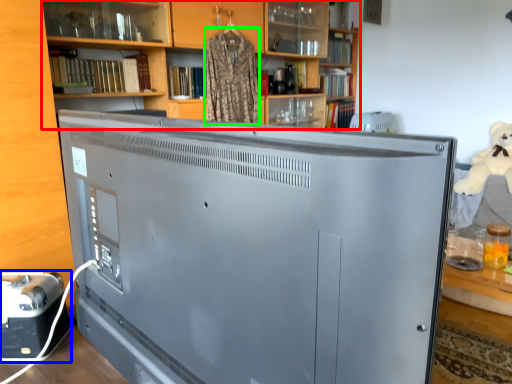
Question: Which is nearer to the bookcase (highlighted by a red box)? appliance (highlighted by a blue box) or clothing (highlighted by a green box).

Choices:
 (A) appliance
 (B) clothing

Answer: (B)